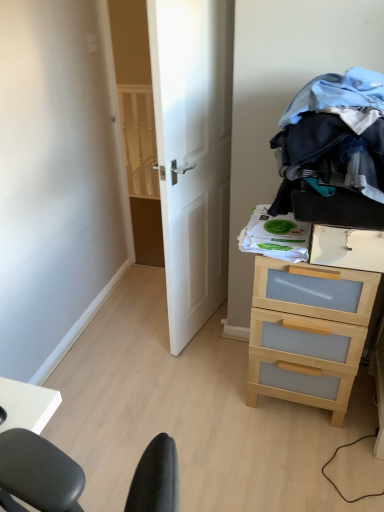
This screenshot has height=512, width=384. Identify the location of vacant area that is in front of white wooden door at center. (196, 377).